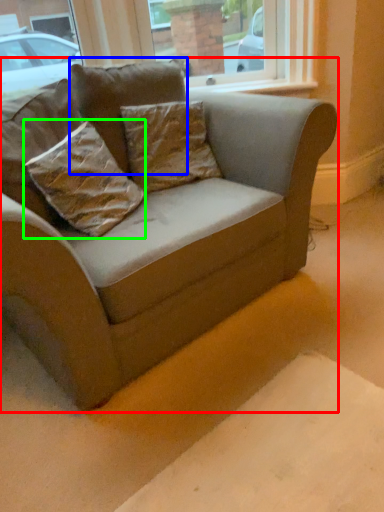
Question: Which object is the closest to the studio couch (highlighted by a red box)? Choose among these: pillow (highlighted by a blue box) or pillow (highlighted by a green box).

Choices:
 (A) pillow
 (B) pillow

Answer: (B)